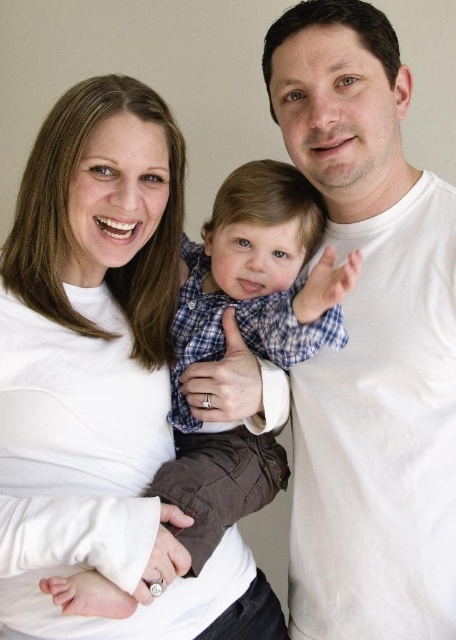
Which is below, white cotton t-shirt at right or blue plaid shirt at center?

Positioned lower is blue plaid shirt at center.

Between point (315, 61) and point (232, 253), which one is positioned behind?

The point (232, 253) is behind.

Describe the element at coordinates (369, 340) in the screenshot. I see `white cotton t-shirt at right` at that location.

This screenshot has width=456, height=640. Identify the location of white cotton t-shirt at right. pyautogui.click(x=369, y=340).

Describe the element at coordinates (248, 337) in the screenshot. I see `blue plaid shirt at center` at that location.

Can you confirm if blue plaid shirt at center is positioned below white soft fabric at center?

Indeed, blue plaid shirt at center is positioned under white soft fabric at center.

Locate an element on the screen. Image resolution: width=456 pixels, height=640 pixels. blue plaid shirt at center is located at coordinates (248, 337).

I want to click on blue plaid shirt at center, so click(x=248, y=337).

Can you confirm if white cotton t-shirt at right is shorter than white soft fabric at center?

No.

Can you confirm if white cotton t-shirt at right is wider than white soft fabric at center?

No, white cotton t-shirt at right is not wider than white soft fabric at center.

Is point (402, 481) behind point (13, 266)?

No, (402, 481) is in front of (13, 266).

Image resolution: width=456 pixels, height=640 pixels. Identify the location of white cotton t-shirt at right. (369, 340).